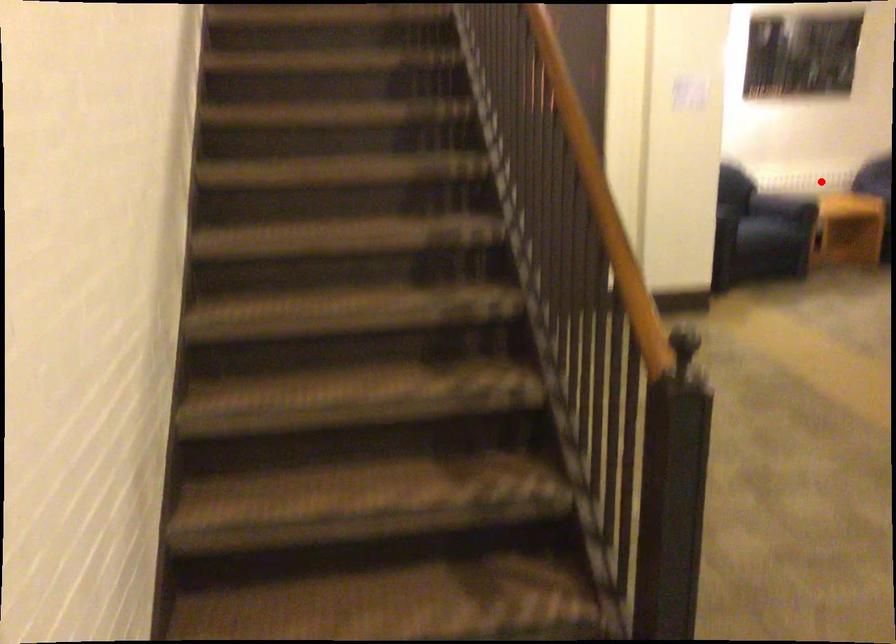
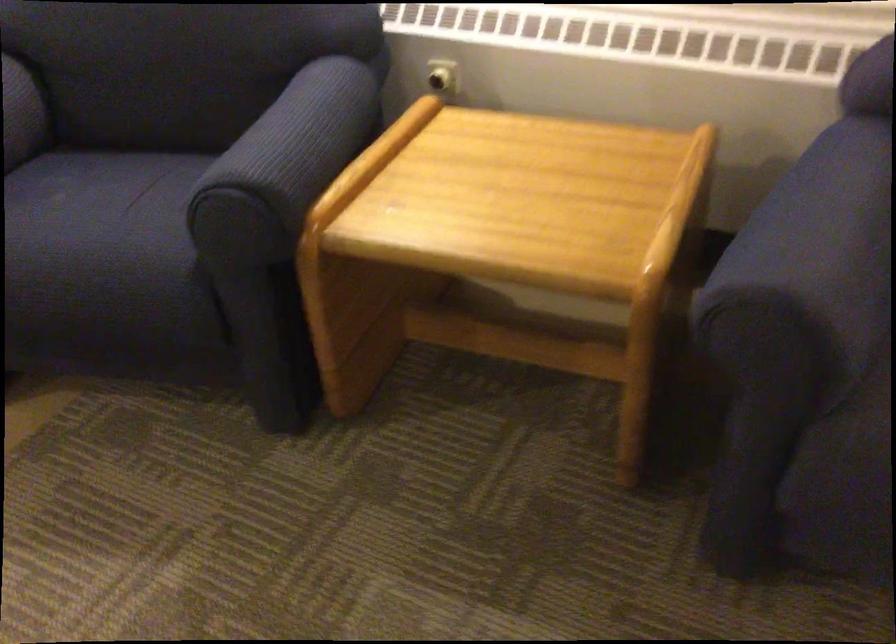
In the second image, find the point that corresponds to the highlighted location in the first image.

(295, 144)